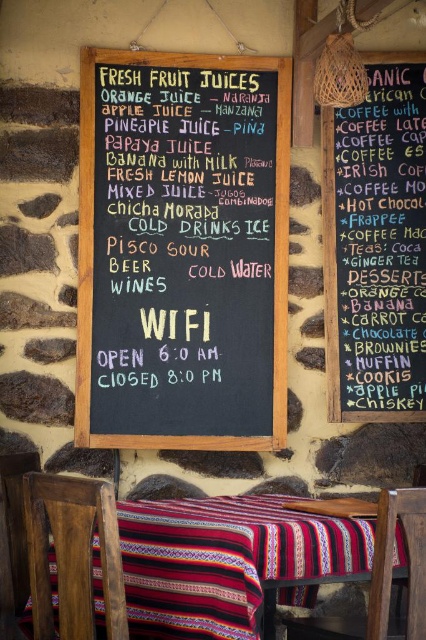
You are sitting on the wooden chair at lower center and want to read the black chalkboard at center. Can you see the entire chalkboard without moving your head?

The black chalkboard at center is above the wooden chair at lower center, so you can see the entire chalkboard by looking upwards without needing to move your head.

Based on the scene description and the objects provided, what does the point at coordinates [183,250] represent?

The point at coordinates [183,250] corresponds to the black chalkboard at center, as stated in the objects description.